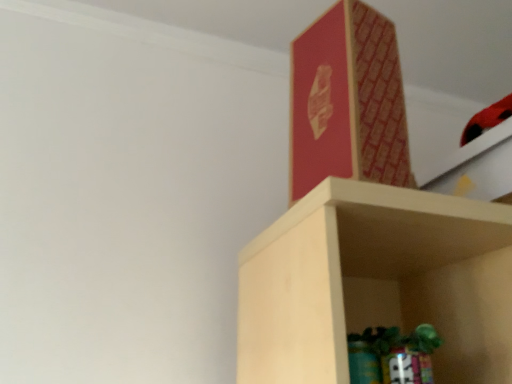
Describe the element at coordinates (348, 101) in the screenshot. I see `matte red sign at upper center` at that location.

What is the approximate width of matte red sign at upper center?

It is 6.41 inches.

Measure the distance between point (391, 107) and camera.

Point (391, 107) is 26.10 inches away from camera.

This screenshot has height=384, width=512. I want to click on matte red sign at upper center, so click(348, 101).

Locate an element on the screen. Image resolution: width=512 pixels, height=384 pixels. matte red sign at upper center is located at coordinates (348, 101).